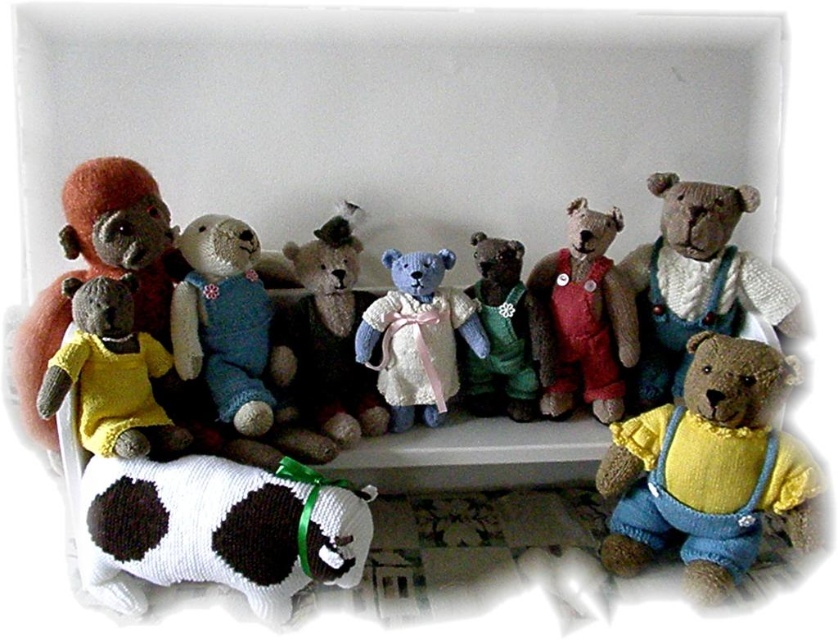
Is fluffy wool monkey at left further to the viewer compared to knitted blue bear at center?

No, it is in front of knitted blue bear at center.

Describe the element at coordinates (96, 268) in the screenshot. This screenshot has height=640, width=838. I see `fluffy wool monkey at left` at that location.

This screenshot has width=838, height=640. What do you see at coordinates (96, 268) in the screenshot? I see `fluffy wool monkey at left` at bounding box center [96, 268].

Locate an element on the screen. fluffy wool monkey at left is located at coordinates (96, 268).

Who is positioned more to the left, knitted beige bear at center or knitted yellow dress at center?

Positioned to the left is knitted yellow dress at center.

Measure the distance between point (776, 296) and camera.

Point (776, 296) is 4.11 feet from camera.

This screenshot has height=640, width=838. What are the coordinates of `knitted beige bear at center` in the screenshot? It's located at (697, 282).

You are a GUI agent. You are given a task and a screenshot of the screen. Output one action in this format:
    pyautogui.click(x=<x>, y=<y>)
    Task: Click on the fluffy wool monkey at left
    Image resolution: width=838 pixels, height=640 pixels.
    Given the screenshot: What is the action you would take?
    pyautogui.click(x=96, y=268)

Who is more distant from viewer, (40, 358) or (345, 326)?

The point (345, 326) is more distant.

This screenshot has height=640, width=838. In order to click on fluffy wool monkey at left in this screenshot , I will do `click(96, 268)`.